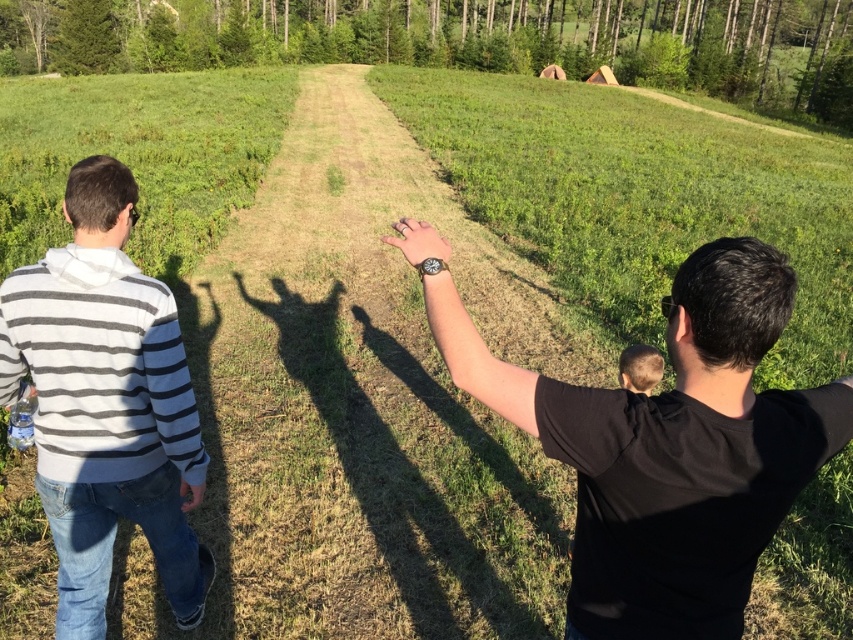
Between point (144, 424) and point (657, 362), which one is positioned behind?

Point (657, 362)

Between white striped hoodie at left and light brown hair at center, which one has more height?

white striped hoodie at left is taller.

Where is `white striped hoodie at left`? white striped hoodie at left is located at coordinates (106, 403).

I want to click on white striped hoodie at left, so click(x=106, y=403).

Is black matte shirt at center below white striped hoodie at left?

No.

Is point (717, 301) farther from camera compared to point (51, 426)?

No, it is in front of (51, 426).

You are a GUI agent. You are given a task and a screenshot of the screen. Output one action in this format:
    pyautogui.click(x=<x>, y=<y>)
    Task: Click on the black matte shirt at center
    
    Given the screenshot: What is the action you would take?
    pyautogui.click(x=669, y=448)

Who is positioned more to the left, black matte shirt at center or matte black watch at center?

matte black watch at center

Who is positioned more to the right, black matte shirt at center or matte black watch at center?

black matte shirt at center is more to the right.

Where is `black matte shirt at center`? This screenshot has width=853, height=640. black matte shirt at center is located at coordinates (669, 448).

Identify the location of black matte shirt at center. (669, 448).